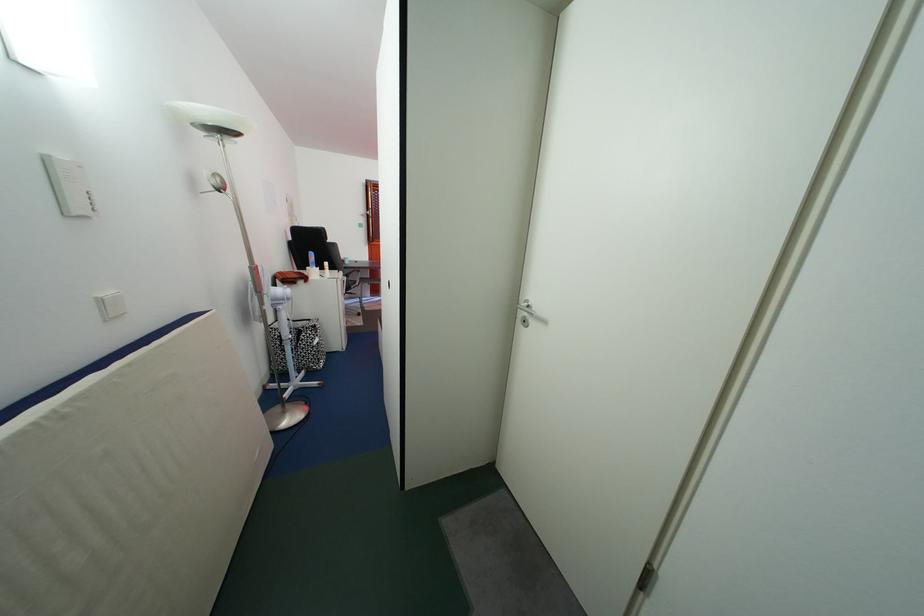
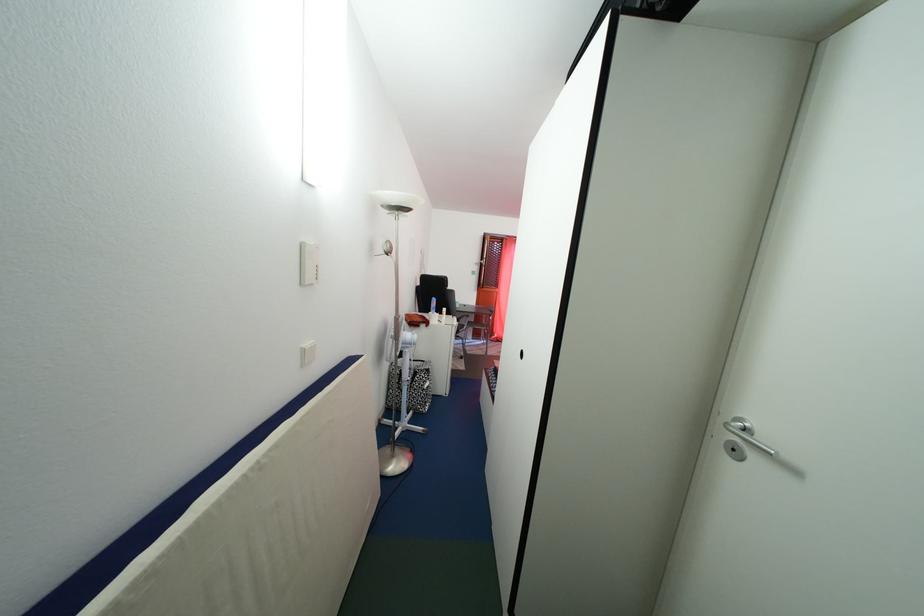
Question: The camera is either moving clockwise (left) or counter-clockwise (right) around the object. The first image is from the beginning of the video and the second image is from the end. Is the camera moving left or right when shooting the video?

Choices:
 (A) Left
 (B) Right

Answer: (B)